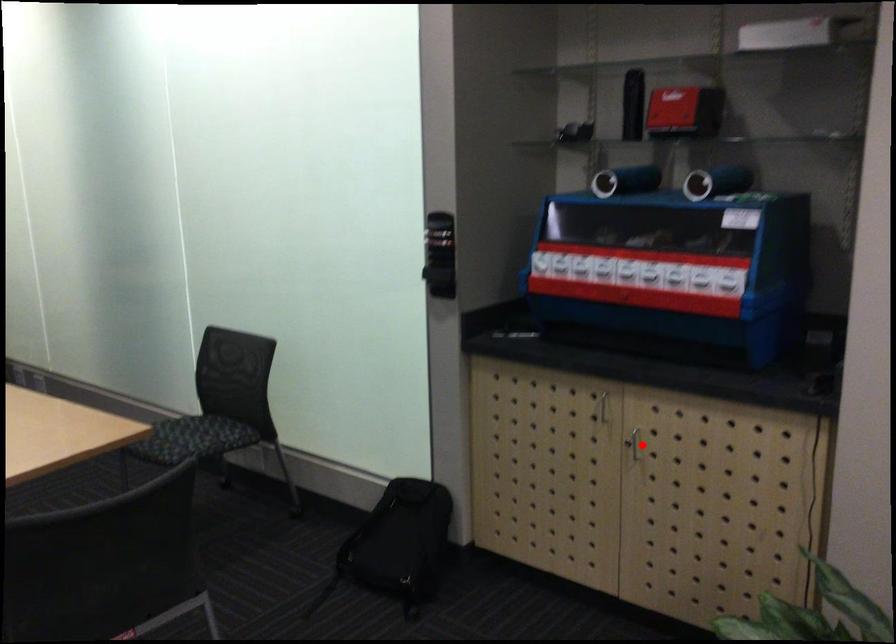
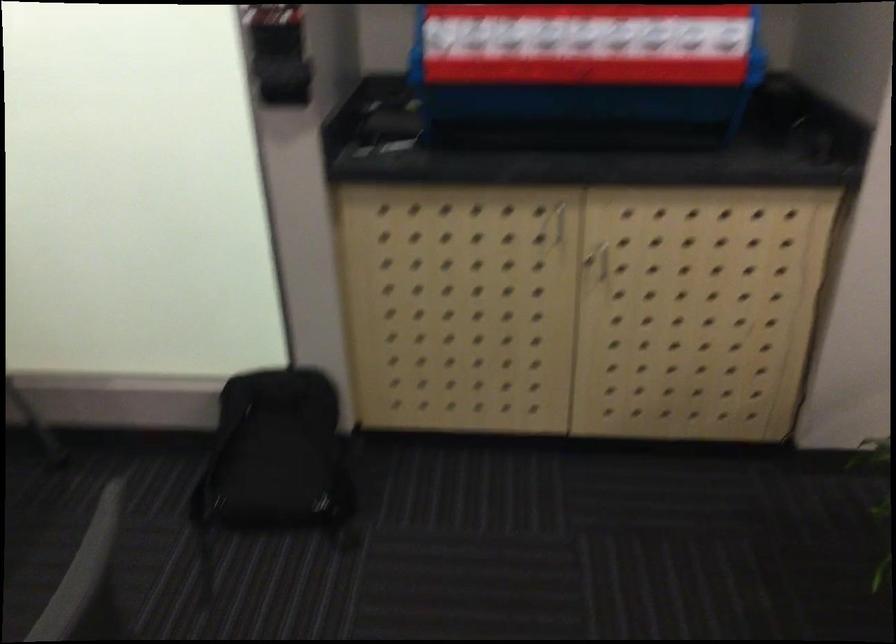
Question: I am providing you with two images of the same scene from different viewpoints. A red point is shown in image1. For the corresponding object point in image2, is it positioned nearer or farther from the camera?

Choices:
 (A) Nearer
 (B) Farther

Answer: (A)